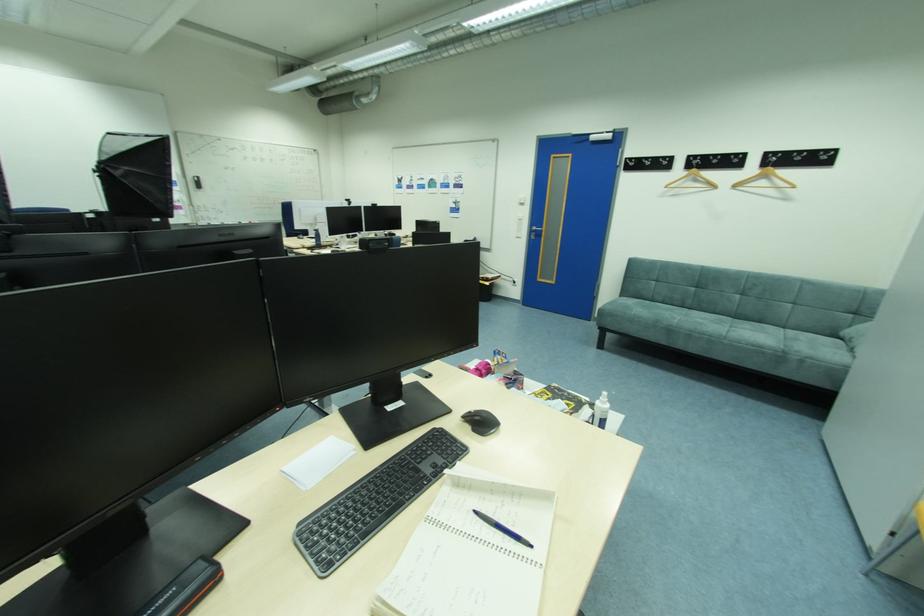
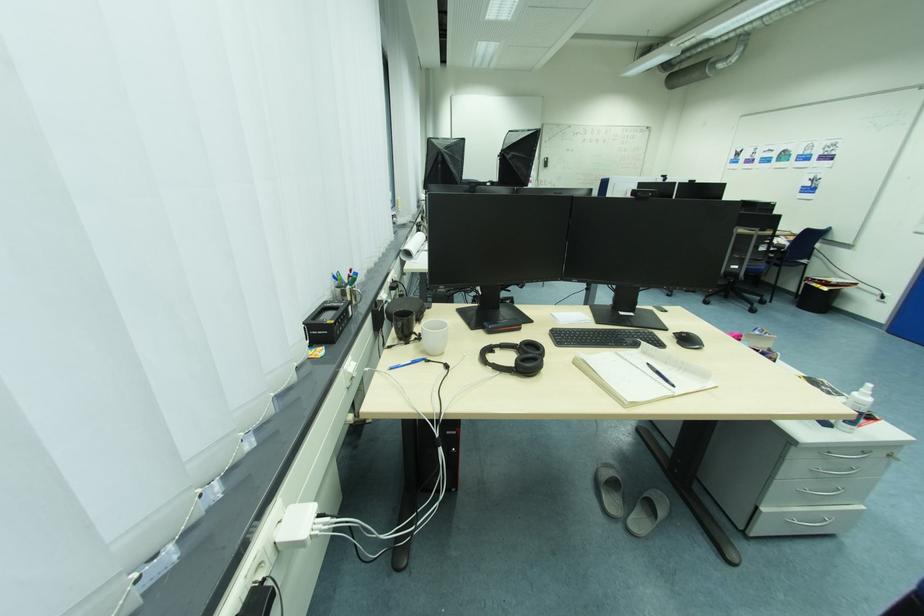
Find the pixel in the second image that matches (609,405) in the first image.

(869, 398)